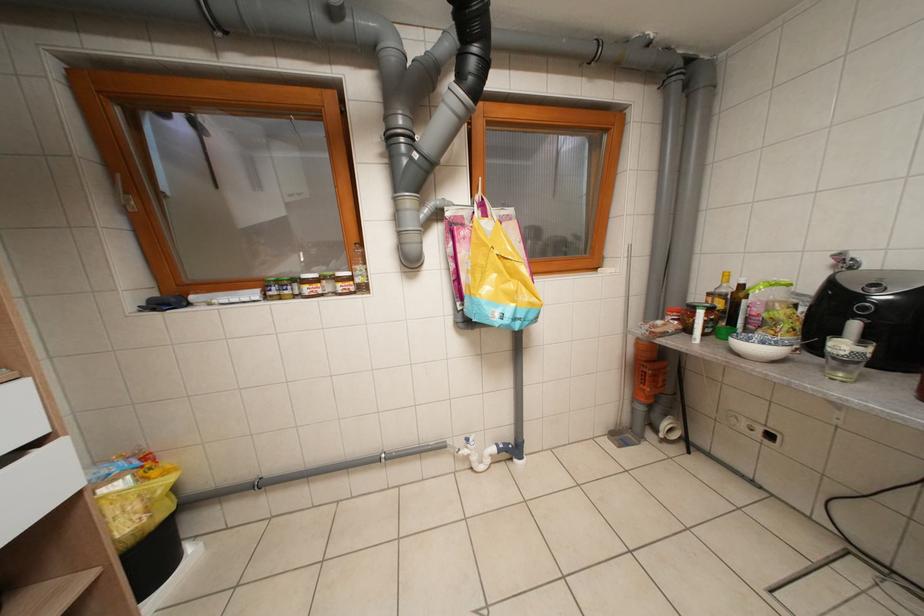
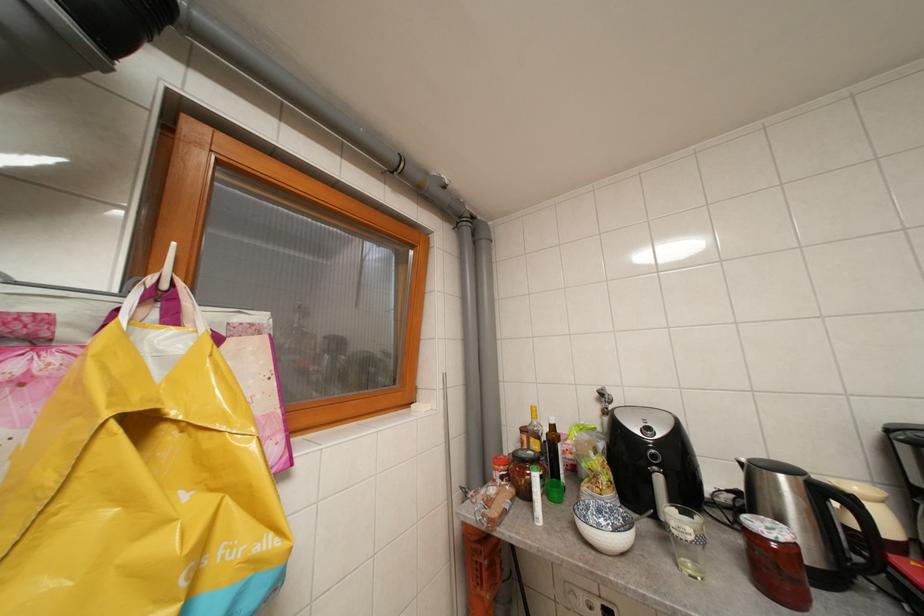
Consider the image. First-person continuous shooting, in which direction is the camera rotating?

The camera's rotation is toward right-up.